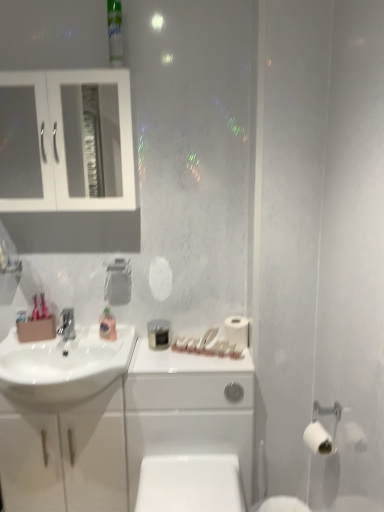
What do you see at coordinates (107, 325) in the screenshot?
I see `translucent plastic mouthwash at sink, which is the first mouthwash in back-to-front order` at bounding box center [107, 325].

What do you see at coordinates (70, 163) in the screenshot?
I see `white glass cabinet at upper left` at bounding box center [70, 163].

The image size is (384, 512). Describe the element at coordinates (190, 484) in the screenshot. I see `white glossy toilet bowl at lower center` at that location.

This screenshot has width=384, height=512. What do you see at coordinates (115, 33) in the screenshot?
I see `green plastic mouthwash at upper center, marked as the 1th mouthwash in a front-to-back arrangement` at bounding box center [115, 33].

In order to face white matte toilet paper at right, marked as the 1th toilet paper in a left-to-right arrangement, should I rotate leftwards or rightwards?

It's best to rotate right around 6.061 degrees.

The height and width of the screenshot is (512, 384). I want to click on white matte toilet paper at right, arranged as the 1th toilet paper when viewed from the front, so click(x=319, y=439).

Locate an element on the screen. mouthwash that is the 2nd one when counting leftward from the white matte toilet paper at right, acting as the 2th toilet paper starting from the top is located at coordinates click(107, 325).

Which is less distant, (111,331) or (323,428)?

Positioned in front is point (323,428).

Does translucent plastic mouthwash at sink, marked as the second mouthwash in a front-to-back arrangement, lie in front of white matte toilet paper at right, which is the 2th toilet paper from left to right?

No, translucent plastic mouthwash at sink, marked as the second mouthwash in a front-to-back arrangement, is behind white matte toilet paper at right, which is the 2th toilet paper from left to right.

Which is more to the right, white glass cabinet at upper left or white glossy sink at left?

From the viewer's perspective, white glass cabinet at upper left appears more on the right side.

Which of these two, white glass cabinet at upper left or white glossy sink at left, is wider?

Wider between the two is white glossy sink at left.

Which of these two, white glass cabinet at upper left or white glossy sink at left, is smaller?

Smaller between the two is white glossy sink at left.

Can you tell me how much white glass cabinet at upper left and white glossy sink at left differ in facing direction?

There is a 0.513-degree angle between the facing directions of white glass cabinet at upper left and white glossy sink at left.

The image size is (384, 512). Identify the location of porcelain behind the white matte toilet paper at right, positioned as the second toilet paper in back-to-front order. (188, 409).

Can you tell me how much white matte toilet paper at right, acting as the 2th toilet paper starting from the top, and white glossy porcelain at center differ in facing direction?

The angular difference between white matte toilet paper at right, acting as the 2th toilet paper starting from the top, and white glossy porcelain at center is 89.8 degrees.

Which is closer, (325, 438) or (194, 412)?

Point (325, 438) is closer to the camera than point (194, 412).

From a real-world perspective, who is located higher, white matte toilet paper at right, the first toilet paper when ordered from right to left, or white glossy porcelain at center?

From a 3D spatial view, white matte toilet paper at right, the first toilet paper when ordered from right to left, is above.

Does white matte toilet paper at right, the second toilet paper from the front, contain matte silver faucet at sink left?

No, matte silver faucet at sink left is not surrounded by white matte toilet paper at right, the second toilet paper from the front.

Is point (231, 334) farther from camera compared to point (65, 334)?

No, (231, 334) is closer to viewer.

Is white matte toilet paper at right, arranged as the 1th toilet paper when viewed from the top, with matte silver faucet at sink left?

They are not placed beside each other.

Is white matte toilet paper at right, acting as the first toilet paper starting from the back, facing towards matte silver faucet at sink left?

No, white matte toilet paper at right, acting as the first toilet paper starting from the back, is not facing towards matte silver faucet at sink left.

Looking at their sizes, would you say white glass cabinet at upper left is wider or thinner than green plastic mouthwash at upper center, the 2th mouthwash from the back?

Clearly, white glass cabinet at upper left has more width compared to green plastic mouthwash at upper center, the 2th mouthwash from the back.

From the image's perspective, between white glass cabinet at upper left and green plastic mouthwash at upper center, which is the first mouthwash in top-to-bottom order, which one is located above?

green plastic mouthwash at upper center, which is the first mouthwash in top-to-bottom order, is shown above in the image.

The image size is (384, 512). In order to click on bathroom cabinet below the green plastic mouthwash at upper center, the second mouthwash in the left-to-right sequence (from a real-world perspective) in this screenshot , I will do [70, 163].

Considering the positions of objects white glass cabinet at upper left and green plastic mouthwash at upper center, the 2th mouthwash from the back, in the image provided, who is in front, white glass cabinet at upper left or green plastic mouthwash at upper center, the 2th mouthwash from the back,?

green plastic mouthwash at upper center, the 2th mouthwash from the back, is closer to the camera.

Can we say white matte toilet paper at right, acting as the first toilet paper starting from the back, lies outside green plastic mouthwash at upper center, the 2th mouthwash from the back?

Absolutely, white matte toilet paper at right, acting as the first toilet paper starting from the back, is external to green plastic mouthwash at upper center, the 2th mouthwash from the back.

From a real-world perspective, is white matte toilet paper at right, arranged as the 1th toilet paper when viewed from the top, below green plastic mouthwash at upper center, the second mouthwash in the left-to-right sequence?

Yes, from a real-world perspective, white matte toilet paper at right, arranged as the 1th toilet paper when viewed from the top, is below green plastic mouthwash at upper center, the second mouthwash in the left-to-right sequence.

Considering the sizes of objects white matte toilet paper at right, the second toilet paper from the front, and green plastic mouthwash at upper center, positioned as the first mouthwash in right-to-left order, in the image provided, who is taller, white matte toilet paper at right, the second toilet paper from the front, or green plastic mouthwash at upper center, positioned as the first mouthwash in right-to-left order,?

green plastic mouthwash at upper center, positioned as the first mouthwash in right-to-left order, is taller.

Which point is more distant from viewer, (244,325) or (119,20)?

Point (244,325)

Visually, is green plastic mouthwash at upper center, the second mouthwash in the bottom-to-top sequence, positioned to the left or to the right of translucent plastic mouthwash at sink, acting as the second mouthwash starting from the top?

From the image, it's evident that green plastic mouthwash at upper center, the second mouthwash in the bottom-to-top sequence, is to the right of translucent plastic mouthwash at sink, acting as the second mouthwash starting from the top.

From their relative heights in the image, would you say green plastic mouthwash at upper center, marked as the 1th mouthwash in a front-to-back arrangement, is taller or shorter than translucent plastic mouthwash at sink, arranged as the 2th mouthwash when viewed from the right?

green plastic mouthwash at upper center, marked as the 1th mouthwash in a front-to-back arrangement, is taller than translucent plastic mouthwash at sink, arranged as the 2th mouthwash when viewed from the right.

From a real-world perspective, between green plastic mouthwash at upper center, positioned as the first mouthwash in right-to-left order, and translucent plastic mouthwash at sink, the 1th mouthwash when ordered from left to right, who is vertically lower?

translucent plastic mouthwash at sink, the 1th mouthwash when ordered from left to right, from a real-world perspective.

Is green plastic mouthwash at upper center, positioned as the first mouthwash in right-to-left order, positioned beyond the bounds of translucent plastic mouthwash at sink, acting as the second mouthwash starting from the top?

Yes, green plastic mouthwash at upper center, positioned as the first mouthwash in right-to-left order, is outside of translucent plastic mouthwash at sink, acting as the second mouthwash starting from the top.

I want to click on the 2nd toilet paper in front of the translucent plastic mouthwash at sink, marked as the second mouthwash in a front-to-back arrangement, so click(x=319, y=439).

You are a GUI agent. You are given a task and a screenshot of the screen. Output one action in this format:
    pyautogui.click(x=<x>, y=<y>)
    Task: Click on the sink that appears below the white glass cabinet at upper left (from the image's perspective)
    The height and width of the screenshot is (512, 384).
    Given the screenshot: What is the action you would take?
    click(63, 366)

Based on their spatial positions, is green plastic mouthwash at upper center, which is the first mouthwash in top-to-bottom order, or white matte toilet paper at right, the first toilet paper when ordered from right to left, further from translucent plastic mouthwash at sink, marked as the second mouthwash in a front-to-back arrangement?

green plastic mouthwash at upper center, which is the first mouthwash in top-to-bottom order, is further to translucent plastic mouthwash at sink, marked as the second mouthwash in a front-to-back arrangement.

Considering their positions, is white glossy sink at left positioned closer to white glass cabinet at upper left than white matte toilet paper at right, arranged as the 1th toilet paper when viewed from the front?

The object closer to white glass cabinet at upper left is white glossy sink at left.

When comparing their distances from matte silver faucet at sink left, does white glossy porcelain at center or white matte toilet paper at right, positioned as the second toilet paper in back-to-front order, seem further?

white matte toilet paper at right, positioned as the second toilet paper in back-to-front order, lies further to matte silver faucet at sink left than the other object.

In the scene shown: Considering their positions, is white glossy sink at left positioned further to white matte toilet paper at right, arranged as the 1th toilet paper when ordered from the bottom, than translucent plastic mouthwash at sink, acting as the second mouthwash starting from the top?

white glossy sink at left.

From the image, which object appears to be nearer to matte silver faucet at sink left, white glossy porcelain at center or white glossy sink at left?

Among the two, white glossy sink at left is located nearer to matte silver faucet at sink left.

Based on the photo, which object lies nearer to the anchor point white matte toilet paper at right, arranged as the 1th toilet paper when viewed from the front, matte silver faucet at sink left or white glossy porcelain at center?

Based on the image, white glossy porcelain at center appears to be nearer to white matte toilet paper at right, arranged as the 1th toilet paper when viewed from the front.

Which object lies nearer to the anchor point translucent plastic mouthwash at sink, marked as the first mouthwash in a bottom-to-top arrangement, white glass cabinet at upper left or white matte toilet paper at right, arranged as the 1th toilet paper when viewed from the top?

white matte toilet paper at right, arranged as the 1th toilet paper when viewed from the top.

From the image, which object appears to be farther from translucent plastic mouthwash at sink, the 1th mouthwash when ordered from left to right, white glossy toilet bowl at lower center or white glossy porcelain at center?

Based on the image, white glossy toilet bowl at lower center appears to be further to translucent plastic mouthwash at sink, the 1th mouthwash when ordered from left to right.

The image size is (384, 512). I want to click on mouthwash between white glass cabinet at upper left and white glossy porcelain at center from top to bottom, so [107, 325].

Find the location of a particular element. This screenshot has width=384, height=512. sink between white glass cabinet at upper left and white glossy toilet bowl at lower center in the vertical direction is located at coordinates (63, 366).

The height and width of the screenshot is (512, 384). I want to click on mouthwash between green plastic mouthwash at upper center, the second mouthwash in the bottom-to-top sequence, and white glossy porcelain at center from top to bottom, so click(x=107, y=325).

What are the coordinates of `mouthwash between green plastic mouthwash at upper center, the second mouthwash in the left-to-right sequence, and white matte toilet paper at right, the 2th toilet paper in the right-to-left sequence, in the up-down direction` in the screenshot? It's located at (107, 325).